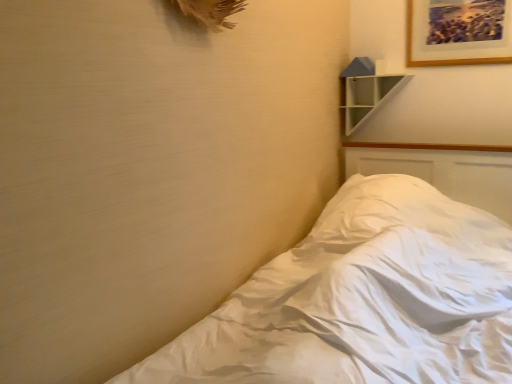
You are a GUI agent. You are given a task and a screenshot of the screen. Output one action in this format:
    pyautogui.click(x=<x>, y=<y>)
    Task: Click on the wooden picture frame at upper right
    The image size is (512, 384).
    Given the screenshot: What is the action you would take?
    pyautogui.click(x=458, y=32)

At what (x,y) coordinates should I click in order to perform the action: click on white glossy shelf at upper right. Please return your answer as a coordinate pair (x, y). Looking at the image, I should click on (365, 91).

Identify the location of wooden picture frame at upper right. (458, 32).

From a real-world perspective, is white glossy shelf at upper right positioned above or below wooden picture frame at upper right?

In terms of real-world spatial position, white glossy shelf at upper right is below wooden picture frame at upper right.

Is white glossy shelf at upper right turned away from wooden picture frame at upper right?

white glossy shelf at upper right is not turned away from wooden picture frame at upper right.

You are a GUI agent. You are given a task and a screenshot of the screen. Output one action in this format:
    pyautogui.click(x=<x>, y=<y>)
    Task: Click on the shelf that appears on the left of wooden picture frame at upper right
    The image size is (512, 384).
    Given the screenshot: What is the action you would take?
    pyautogui.click(x=365, y=91)

From a real-world perspective, is wooden picture frame at upper right positioned under white soft bed at lower right based on gravity?

No, from a real-world perspective, wooden picture frame at upper right is not below white soft bed at lower right.

Is wooden picture frame at upper right touching white soft bed at lower right?

No, wooden picture frame at upper right is not next to white soft bed at lower right.

Which of these two, wooden picture frame at upper right or white soft bed at lower right, stands shorter?

Standing shorter between the two is wooden picture frame at upper right.

From the image's perspective, is wooden picture frame at upper right located beneath white soft bed at lower right?

Actually, wooden picture frame at upper right appears above white soft bed at lower right in the image.

Are white soft bed at lower right and wooden picture frame at upper right far apart?

white soft bed at lower right is positioned a significant distance from wooden picture frame at upper right.

From the image's perspective, is white soft bed at lower right on top of wooden picture frame at upper right?

Actually, white soft bed at lower right appears below wooden picture frame at upper right in the image.

From the picture: Between white soft bed at lower right and wooden picture frame at upper right, which one has less height?

wooden picture frame at upper right is shorter.

Which is nearer, [394,86] or [389,230]?

Point [389,230]

From a real-world perspective, is white glossy shelf at upper right positioned under white soft bed at lower right based on gravity?

No, from a real-world perspective, white glossy shelf at upper right is not beneath white soft bed at lower right.

Which of these two, white glossy shelf at upper right or white soft bed at lower right, is thinner?

Thinner between the two is white glossy shelf at upper right.

Between wooden picture frame at upper right and white glossy shelf at upper right, which one appears on the right side from the viewer's perspective?

wooden picture frame at upper right.

At what (x,y) coordinates should I click in order to perform the action: click on shelf located below the wooden picture frame at upper right (from the image's perspective). Please return your answer as a coordinate pair (x, y). The height and width of the screenshot is (384, 512). Looking at the image, I should click on [x=365, y=91].

Can you confirm if wooden picture frame at upper right is thinner than white glossy shelf at upper right?

Yes.

Could you tell me if white soft bed at lower right is turned towards white glossy shelf at upper right?

No, white soft bed at lower right is not oriented towards white glossy shelf at upper right.

Who is smaller, white soft bed at lower right or white glossy shelf at upper right?

Smaller between the two is white glossy shelf at upper right.

Which object is closer to the camera taking this photo, white soft bed at lower right or white glossy shelf at upper right?

white soft bed at lower right is closer to the camera.

Which is nearer, (469,239) or (344,126)?

Point (469,239).

Where is `shelf on the left of wooden picture frame at upper right`? The height and width of the screenshot is (384, 512). shelf on the left of wooden picture frame at upper right is located at coordinates (365, 91).

Identify the location of bed below the wooden picture frame at upper right (from the image's perspective). This screenshot has width=512, height=384. (362, 300).

Considering their positions, is wooden picture frame at upper right positioned further to white glossy shelf at upper right than white soft bed at lower right?

white soft bed at lower right lies further to white glossy shelf at upper right than the other object.

Which object lies nearer to the anchor point wooden picture frame at upper right, white glossy shelf at upper right or white soft bed at lower right?

white glossy shelf at upper right lies closer to wooden picture frame at upper right than the other object.

Estimate the real-world distances between objects in this image. Which object is closer to white soft bed at lower right, wooden picture frame at upper right or white glossy shelf at upper right?

white glossy shelf at upper right is closer to white soft bed at lower right.

Based on their spatial positions, is white soft bed at lower right or white glossy shelf at upper right further from wooden picture frame at upper right?

The object further to wooden picture frame at upper right is white soft bed at lower right.

Considering their positions, is white glossy shelf at upper right positioned closer to white soft bed at lower right than wooden picture frame at upper right?

white glossy shelf at upper right.

In the scene shown: From the image, which object appears to be farther from white glossy shelf at upper right, white soft bed at lower right or wooden picture frame at upper right?

Among the two, white soft bed at lower right is located further to white glossy shelf at upper right.

Image resolution: width=512 pixels, height=384 pixels. Identify the location of picture frame between white soft bed at lower right and white glossy shelf at upper right along the z-axis. (458, 32).